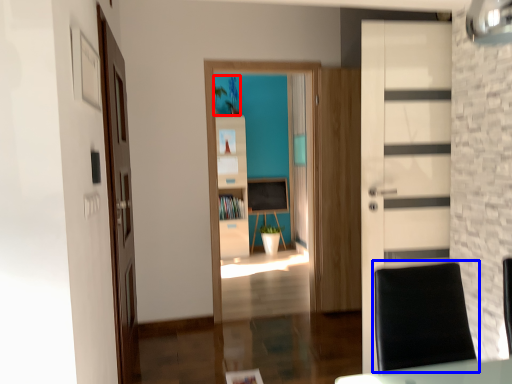
Question: Which object appears farthest to the camera in this image, plant (highlighted by a red box) or swivel chair (highlighted by a blue box)?

Choices:
 (A) plant
 (B) swivel chair

Answer: (A)